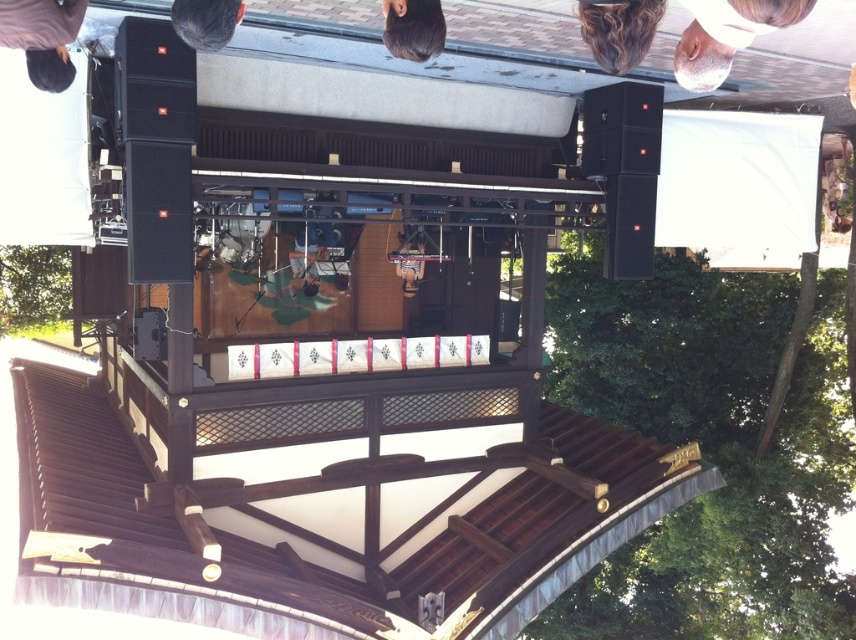
Question: Estimate the real-world distances between objects in this image. Which object is closer to the dark brown sweater at upper left?

Choices:
 (A) white matte hair at upper center
 (B) dark brown hair at upper left

Answer: (B)

Question: Which point appears farthest from the camera in this image?

Choices:
 (A) (382, 32)
 (B) (221, 28)

Answer: (A)

Question: Does white matte hair at upper center appear on the left side of dark brown hair at upper left?

Choices:
 (A) no
 (B) yes

Answer: (A)

Question: Does white matte hair at upper center appear over dark brown sweater at upper left?

Choices:
 (A) no
 (B) yes

Answer: (B)

Question: Which point is farther to the camera?

Choices:
 (A) white matte hair at upper center
 (B) dark brown sweater at upper left
 (C) dark brown hair at upper left

Answer: (C)

Question: Does dark brown hair at upper center have a lesser width compared to dark brown hair at upper left?

Choices:
 (A) no
 (B) yes

Answer: (B)